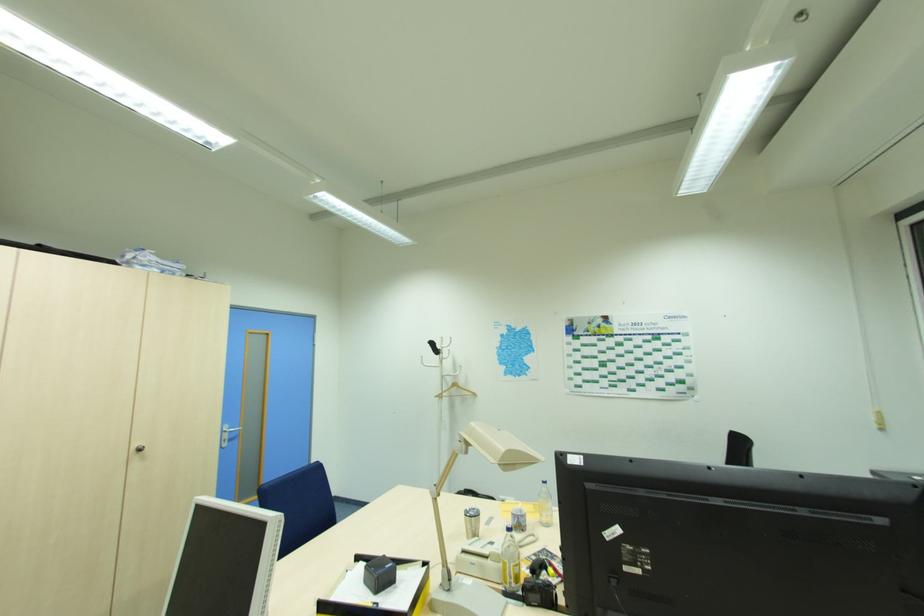
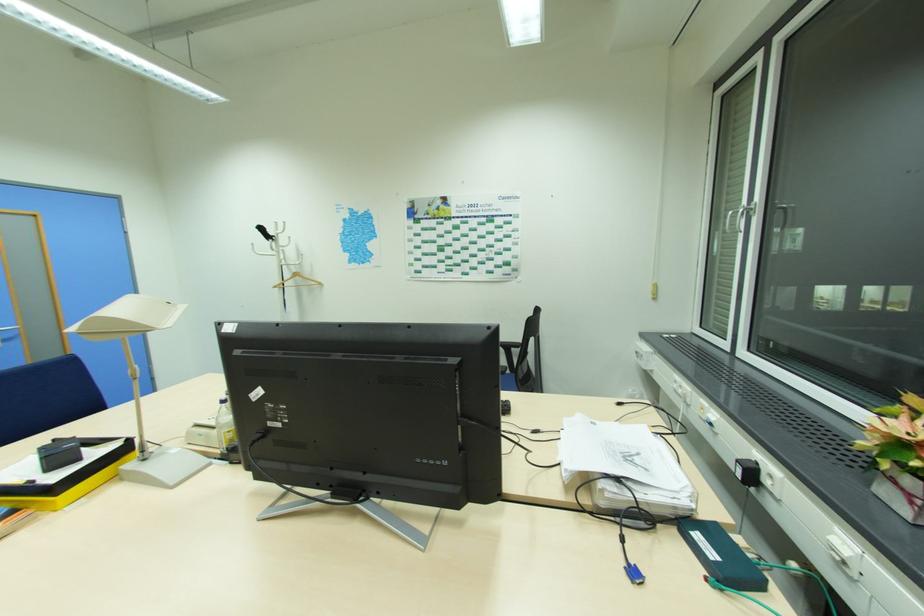
In the second image, find the point that corresponds to point (442, 350) in the first image.

(276, 237)